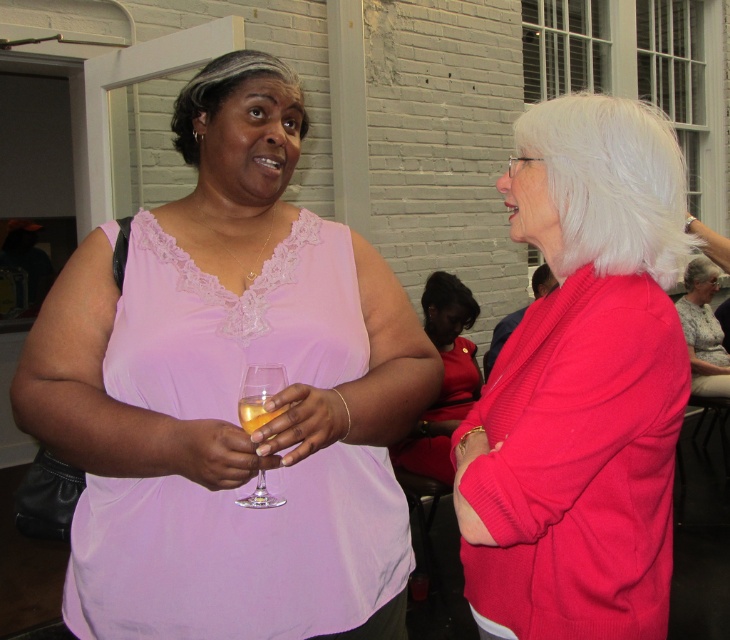
Question: Estimate the real-world distances between objects in this image. Which object is farther from the white silky wig at upper right?

Choices:
 (A) clear glass wine glass at center
 (B) white synthetic wig at upper right
 (C) printed fabric blouse at center
 (D) matte pink blouse at center

Answer: (B)

Question: Is matte red dress at center to the left of translucent glass at center from the viewer's perspective?

Choices:
 (A) no
 (B) yes

Answer: (A)

Question: Is printed fabric blouse at center positioned in front of translucent glass at center?

Choices:
 (A) yes
 (B) no

Answer: (B)

Question: Among these objects, which one is farthest from the camera?

Choices:
 (A) translucent glass at center
 (B) printed fabric blouse at center

Answer: (B)

Question: Which is nearer to the translucent glass at center?

Choices:
 (A) clear glass wine glass at center
 (B) matte red dress at center
 (C) printed fabric blouse at center

Answer: (A)

Question: Is the position of clear glass wine glass at center less distant than that of translucent glass at center?

Choices:
 (A) no
 (B) yes

Answer: (B)